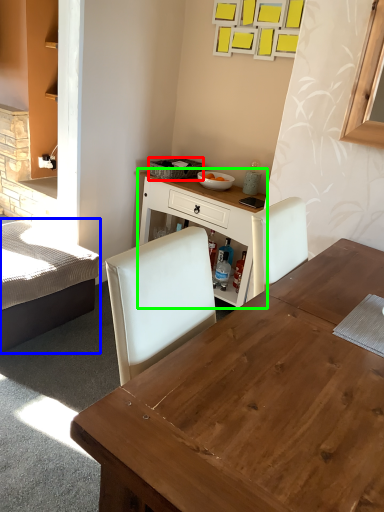
Question: Which object is positioned closest to picnic basket (highlighted by a red box)? Select from bed (highlighted by a blue box) and table (highlighted by a green box).

Choices:
 (A) bed
 (B) table

Answer: (B)